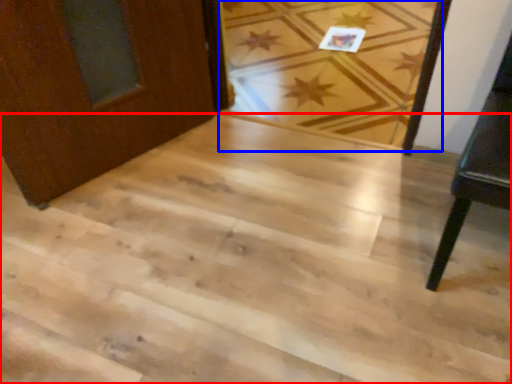
Question: Which of the following is the closest to the observer, stairwell (highlighted by a red box) or plank (highlighted by a blue box)?

Choices:
 (A) stairwell
 (B) plank

Answer: (A)